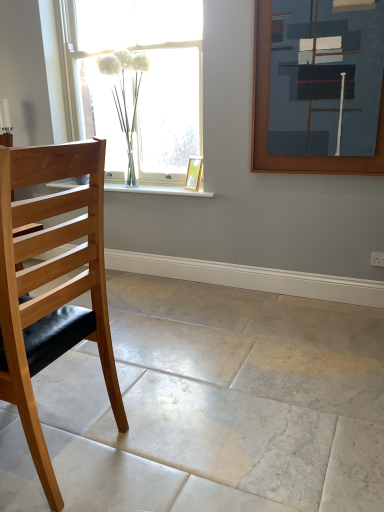
Where is `light wood/black leather chair at left`? This screenshot has height=512, width=384. light wood/black leather chair at left is located at coordinates (49, 281).

Where is `white marble floor at lower left`? This screenshot has height=512, width=384. white marble floor at lower left is located at coordinates (221, 403).

The height and width of the screenshot is (512, 384). What are the coordinates of `gold metallic picture frame at window, arranged as the first picture frame when viewed from the back` in the screenshot? It's located at (194, 173).

Locate an element on the screen. white glass vase at upper center is located at coordinates pos(125,94).

Find the location of a particular element. light wood/black leather chair at left is located at coordinates (49, 281).

Is brown wooden picture frame at upper right, which is the 1th picture frame from right to left, oriented away from white glass vase at upper center?

No, brown wooden picture frame at upper right, which is the 1th picture frame from right to left,'s orientation is not away from white glass vase at upper center.

Which object is wider, brown wooden picture frame at upper right, arranged as the 1th picture frame when viewed from the front, or white glass vase at upper center?

white glass vase at upper center.

Does brown wooden picture frame at upper right, marked as the 2th picture frame in a back-to-front arrangement, have a greater height compared to white glass vase at upper center?

Correct, brown wooden picture frame at upper right, marked as the 2th picture frame in a back-to-front arrangement, is much taller as white glass vase at upper center.

Which object is further away from the camera taking this photo, brown wooden picture frame at upper right, arranged as the 1th picture frame when viewed from the front, or white glass vase at upper center?

white glass vase at upper center is more distant.

Does point (188, 183) appear closer or farther from the camera than point (170, 192)?

Point (188, 183) is positioned farther from the camera compared to point (170, 192).

How different are the orientations of gold metallic picture frame at window, arranged as the first picture frame when viewed from the back, and white marble window sill at center in degrees?

33.3 degrees.

From the image's perspective, which one is positioned lower, gold metallic picture frame at window, arranged as the first picture frame when viewed from the back, or white marble window sill at center?

white marble window sill at center.

Is gold metallic picture frame at window, the 1th picture frame in the left-to-right sequence, not close to white marble window sill at center?

Actually, gold metallic picture frame at window, the 1th picture frame in the left-to-right sequence, and white marble window sill at center are a little close together.

From the image's perspective, is white marble window sill at center below light wood/black leather chair at left?

No.

Is white marble window sill at center outside of light wood/black leather chair at left?

Yes, white marble window sill at center is located beyond the bounds of light wood/black leather chair at left.

Is white marble window sill at center taller or shorter than light wood/black leather chair at left?

In the image, white marble window sill at center appears to be shorter than light wood/black leather chair at left.

In the scene shown: Can you tell me how much white glass vase at upper center and light wood/black leather chair at left differ in facing direction?

white glass vase at upper center and light wood/black leather chair at left are facing 90.5 degrees away from each other.

From the image's perspective, is white glass vase at upper center beneath light wood/black leather chair at left?

No.

Is point (135, 69) positioned after point (13, 383)?

Yes.

Is brown wooden picture frame at upper right, the 2th picture frame in the left-to-right sequence, not inside white marble floor at lower left?

Indeed, brown wooden picture frame at upper right, the 2th picture frame in the left-to-right sequence, is completely outside white marble floor at lower left.

Find the location of `concrete located on the left of brown wooden picture frame at upper right, the 2th picture frame in the left-to-right sequence`. concrete located on the left of brown wooden picture frame at upper right, the 2th picture frame in the left-to-right sequence is located at coordinates (221, 403).

Between brown wooden picture frame at upper right, arranged as the 1th picture frame when viewed from the front, and white marble floor at lower left, which one is positioned in front?

white marble floor at lower left is in front.

From the image's perspective, which is above, brown wooden picture frame at upper right, which is the 1th picture frame from right to left, or white marble floor at lower left?

brown wooden picture frame at upper right, which is the 1th picture frame from right to left, is shown above in the image.

From the image's perspective, does white glass vase at upper center appear lower than gold metallic picture frame at window, marked as the second picture frame in a right-to-left arrangement?

Actually, white glass vase at upper center appears above gold metallic picture frame at window, marked as the second picture frame in a right-to-left arrangement, in the image.

Is point (126, 142) farther from camera compared to point (189, 159)?

Yes, point (126, 142) is behind point (189, 159).

From the picture: In terms of width, does white glass vase at upper center look wider or thinner when compared to gold metallic picture frame at window, the 1th picture frame in the left-to-right sequence?

In the image, white glass vase at upper center appears to be wider than gold metallic picture frame at window, the 1th picture frame in the left-to-right sequence.

Does white glass vase at upper center touch gold metallic picture frame at window, marked as the second picture frame in a right-to-left arrangement?

No, white glass vase at upper center is not touching gold metallic picture frame at window, marked as the second picture frame in a right-to-left arrangement.

Considering the points (364, 322) and (268, 170), which point is behind, point (364, 322) or point (268, 170)?

The point (268, 170) is farther.

Could you tell me if white marble floor at lower left is turned towards brown wooden picture frame at upper right, arranged as the 1th picture frame when viewed from the front?

No, white marble floor at lower left is not turned towards brown wooden picture frame at upper right, arranged as the 1th picture frame when viewed from the front.

From a real-world perspective, is white marble floor at lower left positioned over brown wooden picture frame at upper right, arranged as the 1th picture frame when viewed from the front, based on gravity?

No, from a real-world perspective, white marble floor at lower left is not on top of brown wooden picture frame at upper right, arranged as the 1th picture frame when viewed from the front.

This screenshot has width=384, height=512. In order to click on plant above the brown wooden picture frame at upper right, the 2th picture frame in the left-to-right sequence (from the image's perspective) in this screenshot , I will do `click(125, 94)`.

Identify the location of window sill below the gold metallic picture frame at window, the 1th picture frame in the left-to-right sequence (from a real-world perspective). This screenshot has width=384, height=512. (157, 190).

Looking at the image, which one is located closer to gold metallic picture frame at window, arranged as the first picture frame when viewed from the back, white marble floor at lower left or white marble window sill at center?

Among the two, white marble window sill at center is located nearer to gold metallic picture frame at window, arranged as the first picture frame when viewed from the back.

Based on their spatial positions, is light wood/black leather chair at left or white marble window sill at center closer to white marble floor at lower left?

light wood/black leather chair at left lies closer to white marble floor at lower left than the other object.

Estimate the real-world distances between objects in this image. Which object is closer to white marble window sill at center, gold metallic picture frame at window, arranged as the first picture frame when viewed from the back, or white glass vase at upper center?

gold metallic picture frame at window, arranged as the first picture frame when viewed from the back, lies closer to white marble window sill at center than the other object.

When comparing their distances from gold metallic picture frame at window, marked as the second picture frame in a right-to-left arrangement, does light wood/black leather chair at left or white marble window sill at center seem further?

light wood/black leather chair at left is further to gold metallic picture frame at window, marked as the second picture frame in a right-to-left arrangement.

Estimate the real-world distances between objects in this image. Which object is closer to brown wooden picture frame at upper right, arranged as the 1th picture frame when viewed from the front, white glass vase at upper center or gold metallic picture frame at window, the 1th picture frame in the left-to-right sequence?

gold metallic picture frame at window, the 1th picture frame in the left-to-right sequence, is closer to brown wooden picture frame at upper right, arranged as the 1th picture frame when viewed from the front.

From the image, which object appears to be farther from white glass vase at upper center, white marble window sill at center or light wood/black leather chair at left?

The object further to white glass vase at upper center is light wood/black leather chair at left.

Considering their positions, is white marble floor at lower left positioned closer to gold metallic picture frame at window, marked as the second picture frame in a right-to-left arrangement, than white glass vase at upper center?

white glass vase at upper center is closer to gold metallic picture frame at window, marked as the second picture frame in a right-to-left arrangement.

When comparing their distances from white marble floor at lower left, does light wood/black leather chair at left or brown wooden picture frame at upper right, arranged as the 1th picture frame when viewed from the front, seem closer?

light wood/black leather chair at left is positioned closer to the anchor white marble floor at lower left.

In order to click on plant located between light wood/black leather chair at left and gold metallic picture frame at window, marked as the second picture frame in a right-to-left arrangement, in the depth direction in this screenshot , I will do `click(125, 94)`.

At what (x,y) coordinates should I click in order to perform the action: click on plant between white marble floor at lower left and gold metallic picture frame at window, arranged as the first picture frame when viewed from the back, along the z-axis. Please return your answer as a coordinate pair (x, y). This screenshot has width=384, height=512. Looking at the image, I should click on (125, 94).

You are a GUI agent. You are given a task and a screenshot of the screen. Output one action in this format:
    pyautogui.click(x=<x>, y=<y>)
    Task: Click on the chair between white marble floor at lower left and white glass vase at upper center in the front-back direction
    
    Given the screenshot: What is the action you would take?
    pyautogui.click(x=49, y=281)

Where is `window sill between white glass vase at upper center and brown wooden picture frame at upper right, marked as the 2th picture frame in a back-to-front arrangement`? The width and height of the screenshot is (384, 512). window sill between white glass vase at upper center and brown wooden picture frame at upper right, marked as the 2th picture frame in a back-to-front arrangement is located at coordinates (157, 190).